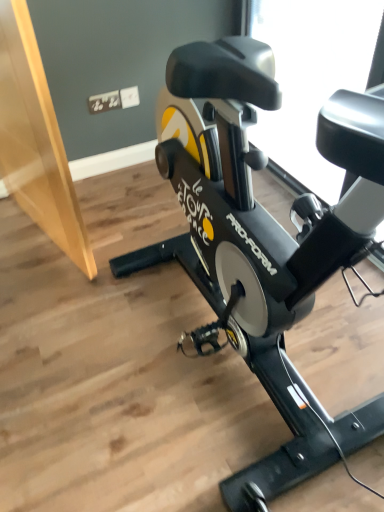
Question: Does transparent glass window at upper center have a lesser width compared to black matte stationary bicycle at center?

Choices:
 (A) yes
 (B) no

Answer: (A)

Question: Considering the relative sizes of transparent glass window at upper center and black matte stationary bicycle at center in the image provided, is transparent glass window at upper center bigger than black matte stationary bicycle at center?

Choices:
 (A) yes
 (B) no

Answer: (B)

Question: From a real-world perspective, is transparent glass window at upper center on black matte stationary bicycle at center?

Choices:
 (A) yes
 (B) no

Answer: (B)

Question: Considering the relative sizes of transparent glass window at upper center and black matte stationary bicycle at center in the image provided, is transparent glass window at upper center smaller than black matte stationary bicycle at center?

Choices:
 (A) no
 (B) yes

Answer: (B)

Question: From the image's perspective, would you say transparent glass window at upper center is positioned over black matte stationary bicycle at center?

Choices:
 (A) no
 (B) yes

Answer: (B)

Question: Is transparent glass window at upper center looking in the opposite direction of black matte stationary bicycle at center?

Choices:
 (A) yes
 (B) no

Answer: (B)

Question: Can you confirm if black matte stationary bicycle at center is wider than transparent glass window at upper center?

Choices:
 (A) no
 (B) yes

Answer: (B)

Question: Can you confirm if black matte stationary bicycle at center is smaller than transparent glass window at upper center?

Choices:
 (A) no
 (B) yes

Answer: (A)

Question: Would you say black matte stationary bicycle at center is a long distance from transparent glass window at upper center?

Choices:
 (A) yes
 (B) no

Answer: (B)

Question: From the image's perspective, does black matte stationary bicycle at center appear lower than transparent glass window at upper center?

Choices:
 (A) yes
 (B) no

Answer: (A)

Question: From the image's perspective, is black matte stationary bicycle at center on transparent glass window at upper center?

Choices:
 (A) no
 (B) yes

Answer: (A)

Question: Is black matte stationary bicycle at center in contact with transparent glass window at upper center?

Choices:
 (A) yes
 (B) no

Answer: (B)

Question: Considering the positions of transparent glass window at upper center and black matte stationary bicycle at center in the image, is transparent glass window at upper center wider or thinner than black matte stationary bicycle at center?

Choices:
 (A) thin
 (B) wide

Answer: (A)